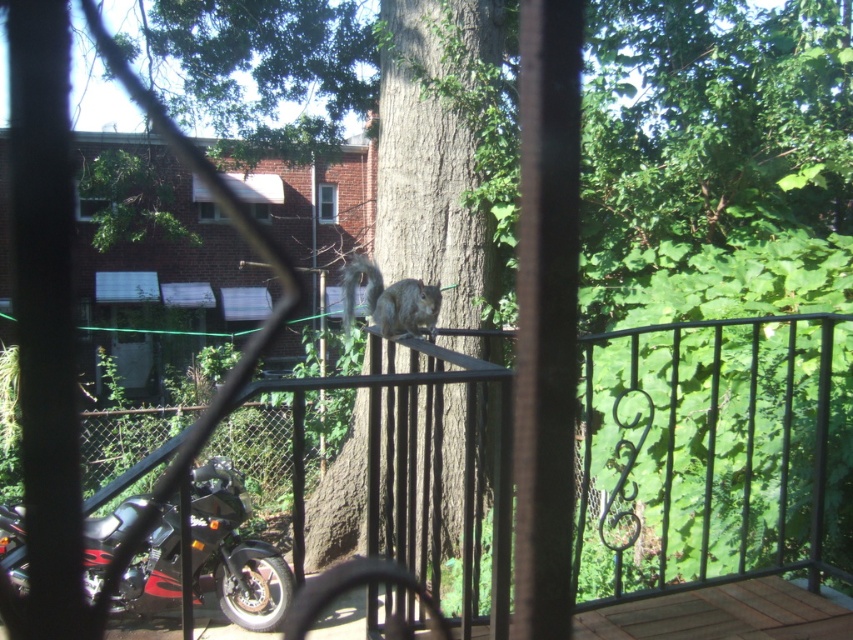
Question: Considering the relative positions of fuzzy gray squirrel at center and transparent plastic screen door at lower left in the image provided, where is fuzzy gray squirrel at center located with respect to transparent plastic screen door at lower left?

Choices:
 (A) left
 (B) right

Answer: (B)

Question: Which object appears farthest from the camera in this image?

Choices:
 (A) transparent plastic screen door at lower left
 (B) black wrought iron fence at center

Answer: (A)

Question: Is the position of black wrought iron fence at center less distant than that of fuzzy gray squirrel at center?

Choices:
 (A) yes
 (B) no

Answer: (A)

Question: Estimate the real-world distances between objects in this image. Which object is closer to the black matte motorcycle at lower left?

Choices:
 (A) fuzzy gray squirrel at center
 (B) black wrought iron fence at center
 (C) transparent plastic screen door at lower left

Answer: (B)

Question: Does black matte motorcycle at lower left appear on the right side of transparent plastic screen door at lower left?

Choices:
 (A) no
 (B) yes

Answer: (B)

Question: Which of the following is the farthest from the observer?

Choices:
 (A) fuzzy gray squirrel at center
 (B) black wrought iron fence at center

Answer: (A)